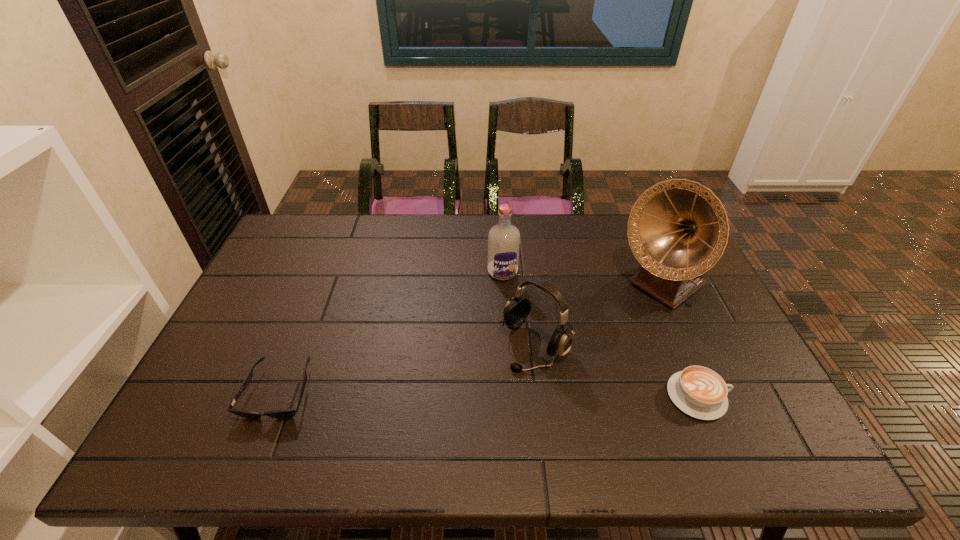
Image resolution: width=960 pixels, height=540 pixels. In order to click on free space on the desktop that is between the sunglasses and the cappuccino and is positioned on the horn of the phonograph record in this screenshot , I will do `click(520, 394)`.

Identify the location of vacant spot on the desktop that is between the leftmost object and the cappuccino and is positioned on the label of the vodka. The width and height of the screenshot is (960, 540). (532, 395).

Locate an element on the screen. The width and height of the screenshot is (960, 540). free space on the desktop that is between the sunglasses and the cappuccino and is positioned with the microphone on the side of the headset is located at coordinates (484, 394).